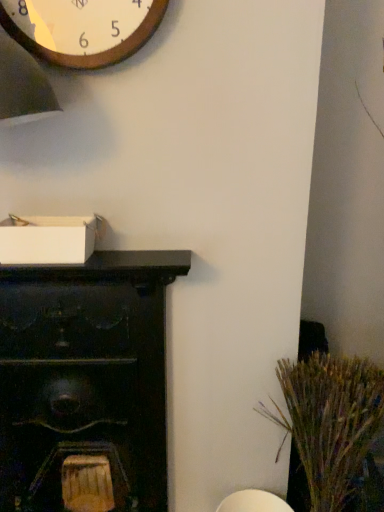
Question: Can dark wood cabinet at left be found inside wooden wall clock at upper left?

Choices:
 (A) no
 (B) yes

Answer: (A)

Question: Is wooden wall clock at upper left completely or partially outside of dark wood cabinet at left?

Choices:
 (A) no
 (B) yes

Answer: (B)

Question: Is wooden wall clock at upper left directly adjacent to dark wood cabinet at left?

Choices:
 (A) no
 (B) yes

Answer: (A)

Question: Is wooden wall clock at upper left oriented towards dark wood cabinet at left?

Choices:
 (A) yes
 (B) no

Answer: (B)

Question: From a real-world perspective, does wooden wall clock at upper left stand above dark wood cabinet at left?

Choices:
 (A) no
 (B) yes

Answer: (B)

Question: Is wooden wall clock at upper left oriented away from dark wood cabinet at left?

Choices:
 (A) yes
 (B) no

Answer: (B)

Question: Is wooden wall clock at upper left thinner than dry grass at right?

Choices:
 (A) yes
 (B) no

Answer: (A)

Question: Could dry grass at right be considered to be inside wooden wall clock at upper left?

Choices:
 (A) no
 (B) yes

Answer: (A)

Question: Can you confirm if wooden wall clock at upper left is bigger than dry grass at right?

Choices:
 (A) no
 (B) yes

Answer: (A)

Question: Can you confirm if wooden wall clock at upper left is positioned to the left of dry grass at right?

Choices:
 (A) no
 (B) yes

Answer: (B)

Question: From the image's perspective, is wooden wall clock at upper left above dry grass at right?

Choices:
 (A) yes
 (B) no

Answer: (A)

Question: Does wooden wall clock at upper left have a greater width compared to dry grass at right?

Choices:
 (A) no
 (B) yes

Answer: (A)

Question: Is dry grass at right with dark wood cabinet at left?

Choices:
 (A) no
 (B) yes

Answer: (A)